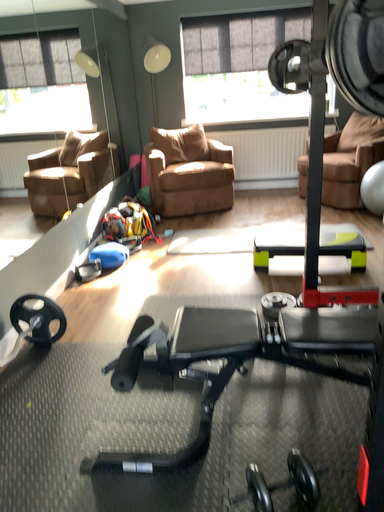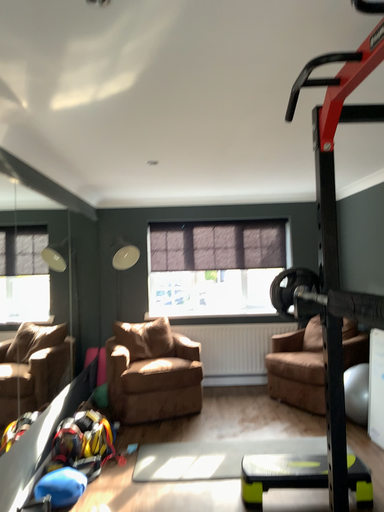
Question: Which way did the camera rotate in the video?

Choices:
 (A) rotated right
 (B) rotated left

Answer: (A)